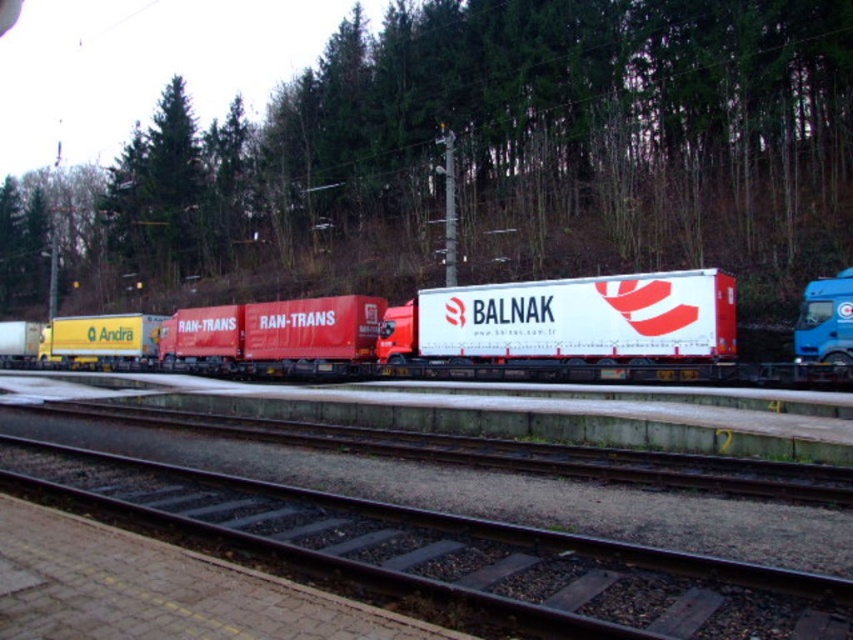
Question: Is black metal train track at center to the right of white glossy trailer truck at center from the viewer's perspective?

Choices:
 (A) yes
 (B) no

Answer: (B)

Question: Does white glossy trailer at center have a smaller size compared to white glossy trailer truck at center?

Choices:
 (A) no
 (B) yes

Answer: (A)

Question: Among these points, which one is nearest to the camera?

Choices:
 (A) (369, 561)
 (B) (718, 32)
 (C) (843, 294)

Answer: (A)

Question: Based on their relative distances, which object is nearer to the green matte tree at upper center?

Choices:
 (A) metal at center
 (B) white glossy trailer truck at center
 (C) white glossy trailer at center

Answer: (C)

Question: Estimate the real-world distances between objects in this image. Which object is farther from the blue metallic truck at right?

Choices:
 (A) green matte tree at upper center
 (B) black metal train track at center

Answer: (A)

Question: Can you confirm if green matte tree at upper center is bigger than metal at center?

Choices:
 (A) yes
 (B) no

Answer: (A)